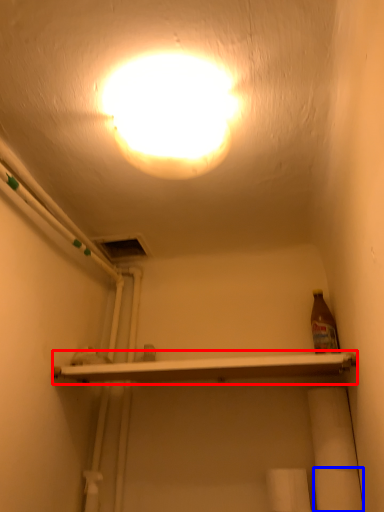
Question: Which point is closer to the camera, shelf (highlighted by a red box) or toilet paper (highlighted by a blue box)?

Choices:
 (A) shelf
 (B) toilet paper

Answer: (A)